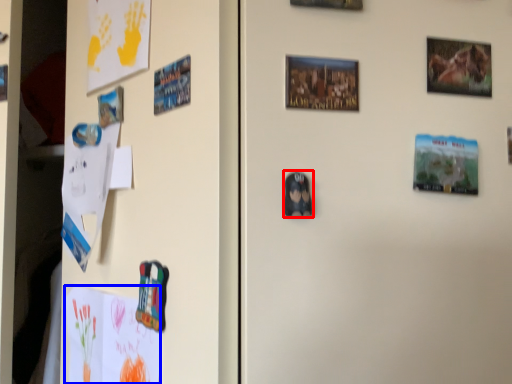
Question: Among these objects, which one is farthest to the camera, print (highlighted by a red box) or postcard (highlighted by a blue box)?

Choices:
 (A) print
 (B) postcard

Answer: (B)